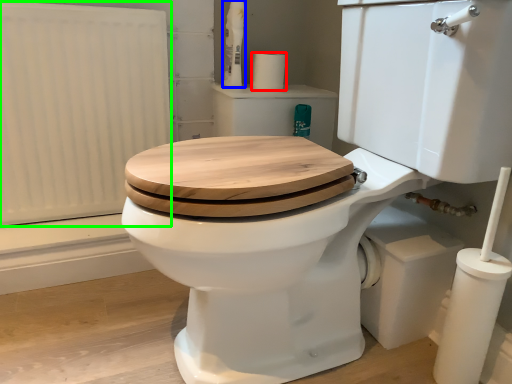
Question: Considering the real-world distances, which object is farthest from toilet paper (highlighted by a red box)? toiletry (highlighted by a blue box) or radiator (highlighted by a green box)?

Choices:
 (A) toiletry
 (B) radiator

Answer: (B)